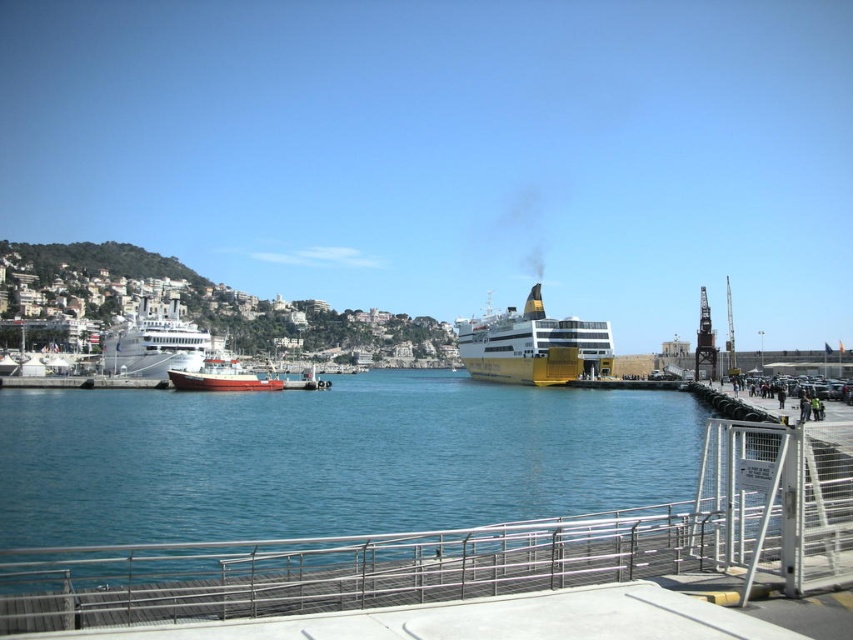
Question: Does white glossy cruise ship at left have a greater width compared to red matte boat at center?

Choices:
 (A) no
 (B) yes

Answer: (B)

Question: Among these points, which one is farthest from the camera?

Choices:
 (A) click(140, 353)
 (B) click(218, 390)
 (C) click(519, 314)

Answer: (C)

Question: Which point is farther from the camera taking this photo?

Choices:
 (A) (538, 337)
 (B) (141, 342)
 (C) (195, 372)
 (D) (422, 461)

Answer: (A)

Question: Is yellow matte cruise ship at center smaller than white glossy cruise ship at left?

Choices:
 (A) yes
 (B) no

Answer: (B)

Question: Among these points, which one is farthest from the camera?

Choices:
 (A) (125, 376)
 (B) (94, 538)
 (C) (213, 381)

Answer: (A)

Question: Is yellow matte cruise ship at center smaller than white glossy cruise ship at left?

Choices:
 (A) yes
 (B) no

Answer: (B)